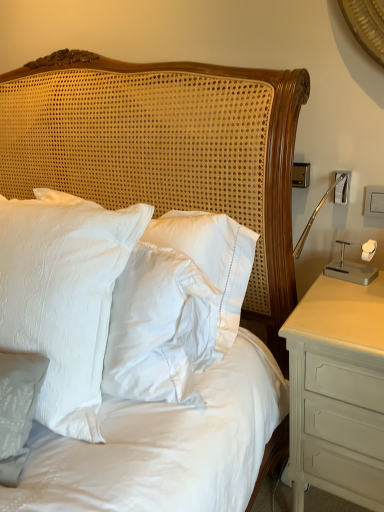
What are the coordinates of `white painted wood nightstand at right` in the screenshot? It's located at (337, 391).

The width and height of the screenshot is (384, 512). In order to click on white satin pillows at center in this screenshot , I will do tap(166, 150).

At what (x,y) coordinates should I click in order to perform the action: click on white satin pillow at center. Please return your answer as a coordinate pair (x, y). Image resolution: width=384 pixels, height=512 pixels. Looking at the image, I should click on (64, 296).

From a real-world perspective, between white satin pillows at center and white painted wood nightstand at right, who is vertically lower?

white painted wood nightstand at right, from a real-world perspective.

Is white satin pillows at center thinner than white painted wood nightstand at right?

Indeed, white satin pillows at center has a lesser width compared to white painted wood nightstand at right.

Is white satin pillows at center spatially inside white painted wood nightstand at right, or outside of it?

white satin pillows at center is spatially situated outside white painted wood nightstand at right.

Between white satin pillows at center and white painted wood nightstand at right, which one has larger size?

white satin pillows at center.

Is white painted wood nightstand at right facing away from white satin pillows at center?

No, white painted wood nightstand at right is not facing away from white satin pillows at center.

From the image's perspective, who appears lower, white painted wood nightstand at right or white satin pillows at center?

white painted wood nightstand at right appears lower in the image.

Does white painted wood nightstand at right lie behind white satin pillows at center?

That is True.

Which of these two, white painted wood nightstand at right or white satin pillows at center, is bigger?

With larger size is white satin pillows at center.

The height and width of the screenshot is (512, 384). What are the coordinates of `nightstand behind the white satin pillow at center` in the screenshot? It's located at (337, 391).

Can you tell me how much white painted wood nightstand at right and white satin pillow at center differ in facing direction?

→ 6.85 degrees separate the facing orientations of white painted wood nightstand at right and white satin pillow at center.

Would you say white painted wood nightstand at right is inside or outside white satin pillow at center?

white painted wood nightstand at right is located beyond the bounds of white satin pillow at center.

From a real-world perspective, is white painted wood nightstand at right on white satin pillow at center?

No, from a real-world perspective, white painted wood nightstand at right is not on top of white satin pillow at center.

Is white satin pillows at center positioned in front of white satin pillow at center?

No, white satin pillows at center is further to the viewer.

Is white satin pillows at center surrounding white satin pillow at center?

No, white satin pillow at center is not inside white satin pillows at center.

How many degrees apart are the facing directions of white satin pillows at center and white satin pillow at center?

They differ by 4.21 degrees in their facing directions.

Which object is wider, white satin pillow at center or white satin pillows at center?

white satin pillow at center is wider.

At what (x,y) coordinates should I click in order to perform the action: click on pillow that is below the white satin pillows at center (from the image's perspective). Please return your answer as a coordinate pair (x, y). The image size is (384, 512). Looking at the image, I should click on [64, 296].

Considering the points (32, 346) and (4, 192), which point is in front, point (32, 346) or point (4, 192)?

The point (32, 346) is closer to the camera.

From a real-world perspective, between white satin pillow at center and white satin pillows at center, who is vertically higher?

From a 3D spatial view, white satin pillow at center is above.

Is white painted wood nightstand at right completely or partially inside white satin pillow at center?

No.

How many degrees apart are the facing directions of white satin pillow at center and white painted wood nightstand at right?

They differ by 6.85 degrees in their facing directions.

From a real-world perspective, is white satin pillow at center located higher than white painted wood nightstand at right?

Yes, from a real-world perspective, white satin pillow at center is over white painted wood nightstand at right

Identify the location of bed in front of the white painted wood nightstand at right. The height and width of the screenshot is (512, 384). (166, 150).

Find the location of `nightstand below the white satin pillows at center (from the image's perspective)`. nightstand below the white satin pillows at center (from the image's perspective) is located at coordinates (337, 391).

Which object lies nearer to the anchor point white painted wood nightstand at right, white satin pillows at center or white satin pillow at center?

white satin pillows at center is positioned closer to the anchor white painted wood nightstand at right.

Considering their positions, is white painted wood nightstand at right positioned further to white satin pillows at center than white satin pillow at center?

Based on the image, white painted wood nightstand at right appears to be further to white satin pillows at center.

Which object lies nearer to the anchor point white satin pillow at center, white satin pillows at center or white painted wood nightstand at right?

white satin pillows at center lies closer to white satin pillow at center than the other object.

Estimate the real-world distances between objects in this image. Which object is closer to white satin pillow at center, white painted wood nightstand at right or white satin pillows at center?

Based on the image, white satin pillows at center appears to be nearer to white satin pillow at center.

Estimate the real-world distances between objects in this image. Which object is further from white painted wood nightstand at right, white satin pillow at center or white satin pillows at center?

Based on the image, white satin pillow at center appears to be further to white painted wood nightstand at right.

Looking at this image, from the image, which object appears to be nearer to white satin pillows at center, white satin pillow at center or white painted wood nightstand at right?

Among the two, white satin pillow at center is located nearer to white satin pillows at center.

This screenshot has height=512, width=384. In order to click on bed located between white satin pillow at center and white painted wood nightstand at right in the left-right direction in this screenshot , I will do `click(166, 150)`.